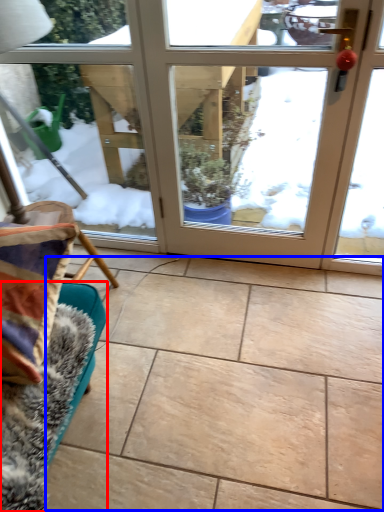
Question: Which object is further to the camera taking this photo, furniture (highlighted by a red box) or ceramic tile (highlighted by a blue box)?

Choices:
 (A) furniture
 (B) ceramic tile

Answer: (B)